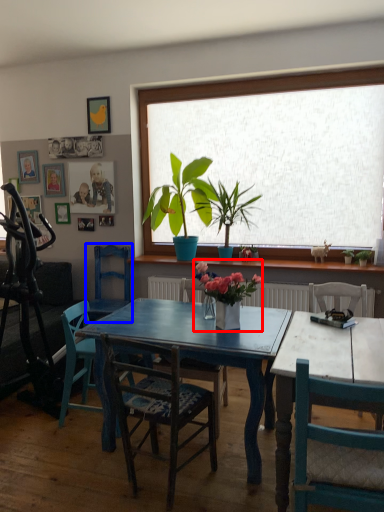
Question: Which of the following is the closest to the observer, houseplant (highlighted by a red box) or chair (highlighted by a blue box)?

Choices:
 (A) houseplant
 (B) chair

Answer: (A)